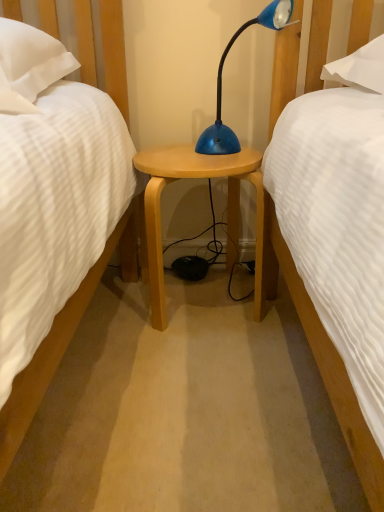
Image resolution: width=384 pixels, height=512 pixels. Find the location of `vacant space that is to the left of blue plastic lamp at center`. vacant space that is to the left of blue plastic lamp at center is located at coordinates (187, 153).